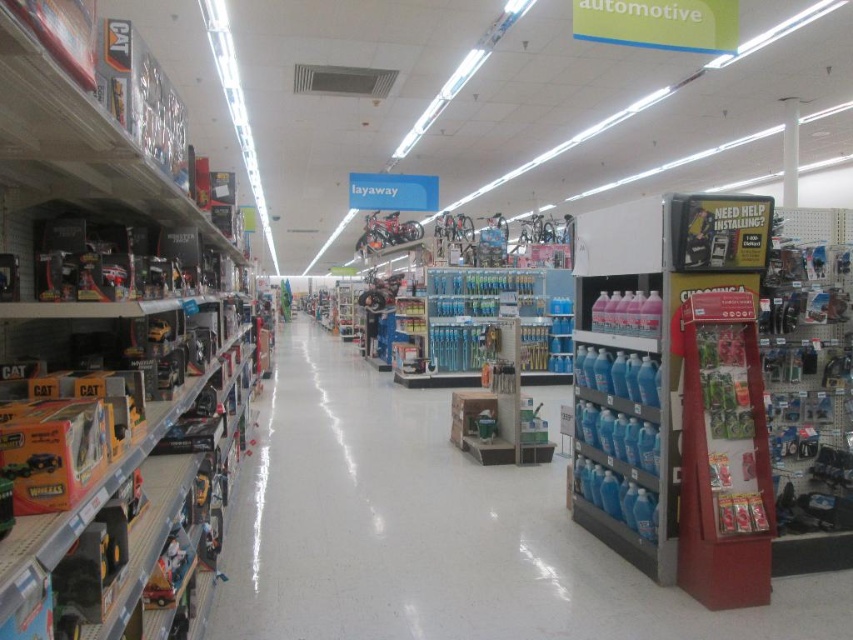
You are a customer in the automotive store and see the clear plastic bottles at center and the metallic silver bicycle at center. Which object takes up more space in the center of the aisle?

The clear plastic bottles at center is bigger than the metallic silver bicycle at center, so it takes up more space in the center of the aisle.

Based on the photo, you are a customer in the automotive section of a store. You see a matte black toy truck at left and a metallic silver bicycle at center. Which object is closer to you?

The matte black toy truck at left is closer to you because it is in front of the metallic silver bicycle at center.